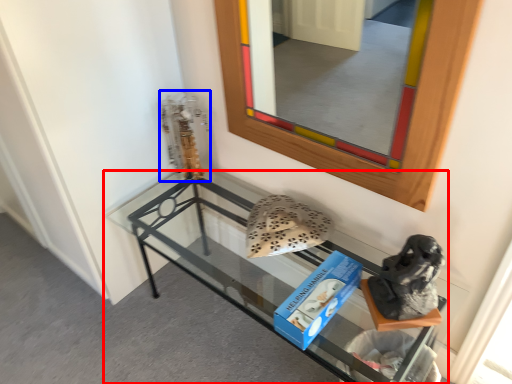
Question: Which object is further to the camera taking this photo, shelf (highlighted by a red box) or sculpture (highlighted by a blue box)?

Choices:
 (A) shelf
 (B) sculpture

Answer: (B)